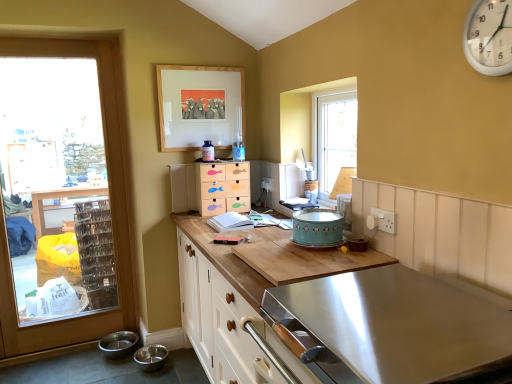
Describe the element at coordinates (200, 106) in the screenshot. I see `wooden picture frame at upper center` at that location.

Find the location of `wooden picture frame at upper center`. wooden picture frame at upper center is located at coordinates pyautogui.click(x=200, y=106).

Locate an element on the screen. teal matte cake stand at center, which ranks as the 1th appliance in right-to-left order is located at coordinates (317, 228).

The height and width of the screenshot is (384, 512). What do you see at coordinates (111, 205) in the screenshot?
I see `wooden door at left` at bounding box center [111, 205].

The width and height of the screenshot is (512, 384). What do you see at coordinates (272, 245) in the screenshot?
I see `wooden cutting board at center, acting as the 2th countertop starting from the bottom` at bounding box center [272, 245].

At what (x,y) coordinates should I click in order to perform the action: click on wooden cutting board at center, acting as the second countertop starting from the top. Please return your answer as a coordinate pair (x, y). The height and width of the screenshot is (384, 512). Looking at the image, I should click on (224, 258).

Is wooden cutting board at center, which appears as the first countertop when viewed from the top, facing towards wooden picture frame at upper center?

No, wooden cutting board at center, which appears as the first countertop when viewed from the top, is not facing towards wooden picture frame at upper center.

How distant is wooden cutting board at center, which appears as the first countertop when viewed from the top, from wooden picture frame at upper center?

wooden cutting board at center, which appears as the first countertop when viewed from the top, and wooden picture frame at upper center are 81.65 centimeters apart.

At what (x,y) coordinates should I click in order to perform the action: click on picture frame on the left side of wooden cutting board at center, acting as the 2th countertop starting from the bottom. Please return your answer as a coordinate pair (x, y). The height and width of the screenshot is (384, 512). Looking at the image, I should click on pos(200,106).

Is the position of wooden cutting board at center, acting as the 2th countertop starting from the bottom, more distant than that of wooden picture frame at upper center?

That is False.

How many degrees apart are the facing directions of wooden picture frame at upper center and teal matte cake stand at center, which is counted as the first appliance, starting from the bottom?

The angular difference between wooden picture frame at upper center and teal matte cake stand at center, which is counted as the first appliance, starting from the bottom, is 90.6 degrees.

Based on their sizes in the image, would you say wooden picture frame at upper center is bigger or smaller than teal matte cake stand at center, acting as the second appliance starting from the back?

In the image, wooden picture frame at upper center appears to be larger than teal matte cake stand at center, acting as the second appliance starting from the back.

Is wooden picture frame at upper center not near teal matte cake stand at center, which is counted as the first appliance, starting from the bottom?

Absolutely, wooden picture frame at upper center is distant from teal matte cake stand at center, which is counted as the first appliance, starting from the bottom.

From a real-world perspective, is wooden picture frame at upper center above or below teal matte cake stand at center, the 1th appliance viewed from the front?

wooden picture frame at upper center is above teal matte cake stand at center, the 1th appliance viewed from the front.

Is wooden door at left in front of or behind white plastic clock at upper right in the image?

Visually, wooden door at left is located behind white plastic clock at upper right.

How much distance is there between wooden door at left and white plastic clock at upper right?

wooden door at left is 2.27 meters from white plastic clock at upper right.

Which point is more distant from viewer, (126,229) or (487,11)?

The point (126,229) is farther from the camera.

Are wooden door at left and white plastic clock at upper right far apart?

Absolutely, wooden door at left is distant from white plastic clock at upper right.

Relative to wooden picture frame at upper center, is white plastic clock at upper right in front or behind?

In the image, white plastic clock at upper right appears in front of wooden picture frame at upper center.

What's the angular difference between white plastic clock at upper right and wooden picture frame at upper center's facing directions?

90.6 degrees.

Considering the relative sizes of white plastic clock at upper right and wooden picture frame at upper center in the image provided, is white plastic clock at upper right shorter than wooden picture frame at upper center?

Indeed, white plastic clock at upper right has a lesser height compared to wooden picture frame at upper center.

Considering the sizes of objects white plastic clock at upper right and wooden picture frame at upper center in the image provided, who is thinner, white plastic clock at upper right or wooden picture frame at upper center?

Thinner between the two is white plastic clock at upper right.

Which object is further away from the camera taking this photo, wooden cutting board at center, the 1th countertop in the bottom-to-top sequence, or wooden door at left?

→ Positioned behind is wooden door at left.

Could you tell me if wooden cutting board at center, acting as the second countertop starting from the top, is facing wooden door at left?

Yes.

Consider the image. From the image's perspective, is wooden cutting board at center, acting as the second countertop starting from the top, positioned above or below wooden door at left?

wooden cutting board at center, acting as the second countertop starting from the top, is below wooden door at left.

Is wooden cutting board at center, acting as the second countertop starting from the top, positioned far away from wooden door at left?

wooden cutting board at center, acting as the second countertop starting from the top, is far away from wooden door at left.

Measure the distance from wooden drawers at center, the first appliance when ordered from top to bottom, to white plastic clock at upper right.

wooden drawers at center, the first appliance when ordered from top to bottom, is 1.85 meters away from white plastic clock at upper right.

Is wooden drawers at center, which ranks as the first appliance in back-to-front order, inside or outside of white plastic clock at upper right?

wooden drawers at center, which ranks as the first appliance in back-to-front order, is not inside white plastic clock at upper right, it's outside.

Between wooden drawers at center, the 2th appliance from the right, and white plastic clock at upper right, which one has larger width?

wooden drawers at center, the 2th appliance from the right, is wider.

What's the angular difference between wooden drawers at center, which is the 2th appliance from bottom to top, and white plastic clock at upper right's facing directions?

85.8 degrees separate the facing orientations of wooden drawers at center, which is the 2th appliance from bottom to top, and white plastic clock at upper right.

Is wooden cutting board at center, acting as the 2th countertop starting from the bottom, directly adjacent to wooden fish-themed drawer set at center?

wooden cutting board at center, acting as the 2th countertop starting from the bottom, and wooden fish-themed drawer set at center are clearly separated.

Looking at this image, can you confirm if wooden cutting board at center, which appears as the first countertop when viewed from the top, is wider than wooden fish-themed drawer set at center?

Indeed, wooden cutting board at center, which appears as the first countertop when viewed from the top, has a greater width compared to wooden fish-themed drawer set at center.

Measure the distance between wooden cutting board at center, acting as the 2th countertop starting from the bottom, and wooden fish-themed drawer set at center.

wooden cutting board at center, acting as the 2th countertop starting from the bottom, and wooden fish-themed drawer set at center are 16.63 inches apart.

In the image, is wooden cutting board at center, acting as the 2th countertop starting from the bottom, on the left side or the right side of wooden fish-themed drawer set at center?

In the image, wooden cutting board at center, acting as the 2th countertop starting from the bottom, appears on the right side of wooden fish-themed drawer set at center.

At what (x,y) coordinates should I click in order to perform the action: click on picture frame on the left of the wooden cutting board at center, which appears as the first countertop when viewed from the top. Please return your answer as a coordinate pair (x, y). The height and width of the screenshot is (384, 512). Looking at the image, I should click on (200, 106).

Identify the location of picture frame above the teal matte cake stand at center, acting as the second appliance starting from the top (from the image's perspective). (200, 106).

From the image, which object appears to be nearer to wooden cutting board at center, acting as the 2th countertop starting from the bottom, teal matte cake stand at center, arranged as the 2th appliance when viewed from the left, or wooden fish-themed drawer set at center?

teal matte cake stand at center, arranged as the 2th appliance when viewed from the left, is positioned closer to the anchor wooden cutting board at center, acting as the 2th countertop starting from the bottom.

When comparing their distances from wooden cutting board at center, acting as the 2th countertop starting from the bottom, does wooden picture frame at upper center or wooden cutting board at center, acting as the second countertop starting from the top, seem closer?

Based on the image, wooden cutting board at center, acting as the second countertop starting from the top, appears to be nearer to wooden cutting board at center, acting as the 2th countertop starting from the bottom.

Looking at the image, which one is located further to teal matte cake stand at center, acting as the second appliance starting from the back, wooden cutting board at center, acting as the 2th countertop starting from the bottom, or wooden fish-themed drawer set at center?

wooden fish-themed drawer set at center.

Considering their positions, is wooden door at left positioned further to teal matte cake stand at center, the 1th appliance viewed from the front, than wooden cutting board at center, acting as the 2th countertop starting from the bottom?

wooden door at left is further to teal matte cake stand at center, the 1th appliance viewed from the front.

Estimate the real-world distances between objects in this image. Which object is closer to wooden fish-themed drawer set at center, wooden picture frame at upper center or wooden cutting board at center, which appears as the first countertop when viewed from the top?

wooden picture frame at upper center is positioned closer to the anchor wooden fish-themed drawer set at center.

Considering their positions, is wooden drawers at center, acting as the second appliance starting from the front, positioned closer to wooden cutting board at center, the 1th countertop in the bottom-to-top sequence, than white plastic clock at upper right?

wooden drawers at center, acting as the second appliance starting from the front.

When comparing their distances from wooden drawers at center, which is the 2th appliance from bottom to top, does wooden cutting board at center, acting as the 2th countertop starting from the bottom, or wooden door at left seem further?

wooden cutting board at center, acting as the 2th countertop starting from the bottom, is positioned further to the anchor wooden drawers at center, which is the 2th appliance from bottom to top.

Estimate the real-world distances between objects in this image. Which object is further from white plastic clock at upper right, teal matte cake stand at center, which ranks as the 1th appliance in right-to-left order, or wooden picture frame at upper center?

wooden picture frame at upper center.

Find the location of a particular element. countertop between wooden cutting board at center, the 1th countertop in the bottom-to-top sequence, and wooden fish-themed drawer set at center in the front-back direction is located at coordinates (272, 245).

Identify the location of appliance between wooden cutting board at center, acting as the 2th countertop starting from the bottom, and wooden picture frame at upper center from front to back. (317, 228).

Find the location of `picture frame between white plastic clock at upper right and wooden fish-themed drawer set at center from front to back`. picture frame between white plastic clock at upper right and wooden fish-themed drawer set at center from front to back is located at coordinates (200, 106).

I want to click on countertop situated between wooden door at left and wooden cutting board at center, acting as the 2th countertop starting from the bottom, from left to right, so click(224, 258).